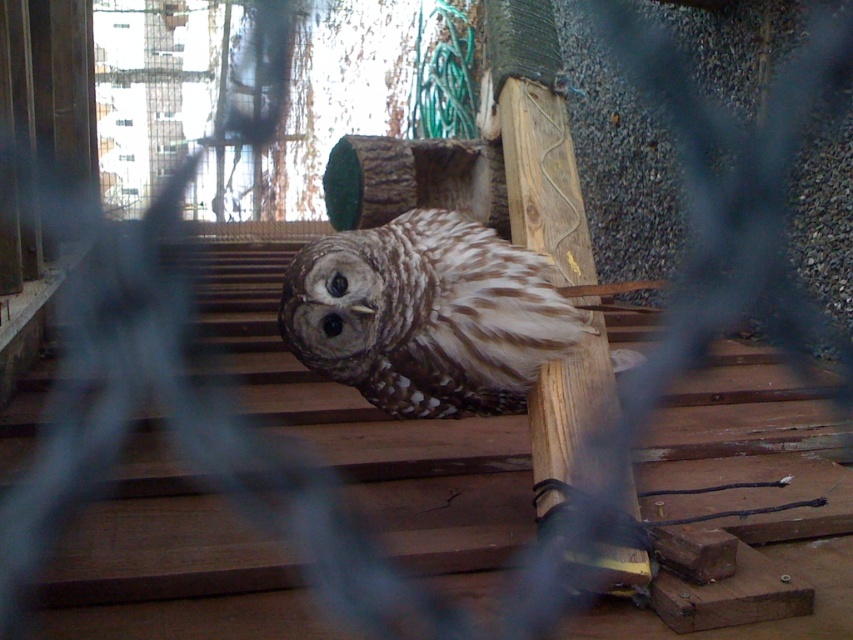
Who is higher up, brown wood stairs at center or brown speckled feathers at center?

brown speckled feathers at center is above.

Locate an element on the screen. brown wood stairs at center is located at coordinates [370, 433].